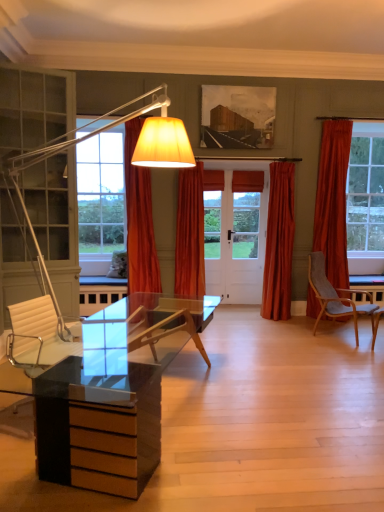
Identify the location of orange velvet curtain at center, the second curtain when ordered from left to right. (190, 234).

Identify the location of fluffy white pillow at left. This screenshot has height=512, width=384. (118, 265).

The image size is (384, 512). Describe the element at coordinates (118, 265) in the screenshot. I see `fluffy white pillow at left` at that location.

Identify the location of velvet orange curtain at center, marked as the 1th curtain in a right-to-left arrangement. (279, 243).

Find the location of a particular element. This screenshot has width=384, height=512. wooden textured painting at upper center is located at coordinates 237,117.

Locate an element on the screen. orange velvet curtain at center, the second curtain when ordered from left to right is located at coordinates (190, 234).

How different are the orientations of orange velvet curtain at center, which is the second curtain from right to left, and fluffy white pillow at left in degrees?

17 degrees.

Which is more to the right, orange velvet curtain at center, which is the second curtain from right to left, or fluffy white pillow at left?

Positioned to the right is orange velvet curtain at center, which is the second curtain from right to left.

Is fluffy white pillow at left at the back of orange velvet curtain at center, the second curtain when ordered from left to right?

No, fluffy white pillow at left is not at the back of orange velvet curtain at center, the second curtain when ordered from left to right.

From the picture: Can you confirm if fluffy white pillow at left is wider than wooden textured painting at upper center?

Indeed, fluffy white pillow at left has a greater width compared to wooden textured painting at upper center.

Is wooden textured painting at upper center a part of fluffy white pillow at left?

No.

Considering the sizes of objects fluffy white pillow at left and wooden textured painting at upper center in the image provided, who is smaller, fluffy white pillow at left or wooden textured painting at upper center?

fluffy white pillow at left.

Between fluffy white pillow at left and wooden textured painting at upper center, which one appears on the right side from the viewer's perspective?

From the viewer's perspective, wooden textured painting at upper center appears more on the right side.

Looking at this image, is orange fabric curtain at center, the third curtain viewed from the right, next to orange velvet curtain at center, the second curtain when ordered from left to right, and touching it?

No, orange fabric curtain at center, the third curtain viewed from the right, is not next to orange velvet curtain at center, the second curtain when ordered from left to right.

Does point (128, 264) come closer to viewer compared to point (200, 172)?

Yes, it is in front of point (200, 172).

Considering the sizes of objects orange fabric curtain at center, the 1th curtain positioned from the left, and orange velvet curtain at center, which is the second curtain from right to left, in the image provided, who is wider, orange fabric curtain at center, the 1th curtain positioned from the left, or orange velvet curtain at center, which is the second curtain from right to left,?

Wider between the two is orange fabric curtain at center, the 1th curtain positioned from the left.

Can you confirm if orange fabric curtain at center, the third curtain viewed from the right, is smaller than orange velvet curtain at center, the second curtain when ordered from left to right?

No.

Between orange velvet curtain at center, the second curtain when ordered from left to right, and orange fabric curtain at center, the 1th curtain positioned from the left, which one appears on the left side from the viewer's perspective?

Positioned to the left is orange fabric curtain at center, the 1th curtain positioned from the left.

Is orange velvet curtain at center, the second curtain when ordered from left to right, far from orange fabric curtain at center, the third curtain viewed from the right?

No, there isn't a large distance between orange velvet curtain at center, the second curtain when ordered from left to right, and orange fabric curtain at center, the third curtain viewed from the right.

Based on their sizes in the image, would you say orange velvet curtain at center, the second curtain when ordered from left to right, is bigger or smaller than orange fabric curtain at center, the 1th curtain positioned from the left?

Clearly, orange velvet curtain at center, the second curtain when ordered from left to right, is smaller in size than orange fabric curtain at center, the 1th curtain positioned from the left.

Are orange velvet curtain at center, which is the second curtain from right to left, and wooden textured painting at upper center located far from each other?

orange velvet curtain at center, which is the second curtain from right to left, is positioned a significant distance from wooden textured painting at upper center.

Is orange velvet curtain at center, which is the second curtain from right to left, spatially inside wooden textured painting at upper center, or outside of it?

orange velvet curtain at center, which is the second curtain from right to left, is located beyond the bounds of wooden textured painting at upper center.

Is orange velvet curtain at center, which is the second curtain from right to left, facing towards wooden textured painting at upper center?

No, orange velvet curtain at center, which is the second curtain from right to left, is not turned towards wooden textured painting at upper center.

Looking at this image, who is taller, orange velvet curtain at center, which is the second curtain from right to left, or wooden textured painting at upper center?

Standing taller between the two is orange velvet curtain at center, which is the second curtain from right to left.

In the scene shown: Considering the sizes of orange velvet curtain at center, the second curtain when ordered from left to right, and velvet orange curtain at center, marked as the 1th curtain in a right-to-left arrangement, in the image, is orange velvet curtain at center, the second curtain when ordered from left to right, wider or thinner than velvet orange curtain at center, marked as the 1th curtain in a right-to-left arrangement,?

Clearly, orange velvet curtain at center, the second curtain when ordered from left to right, has more width compared to velvet orange curtain at center, marked as the 1th curtain in a right-to-left arrangement.

Between orange velvet curtain at center, which is the second curtain from right to left, and velvet orange curtain at center, which ranks as the third curtain in left-to-right order, which one appears on the right side from the viewer's perspective?

velvet orange curtain at center, which ranks as the third curtain in left-to-right order.

Which is in front, orange velvet curtain at center, the second curtain when ordered from left to right, or velvet orange curtain at center, which ranks as the third curtain in left-to-right order?

orange velvet curtain at center, the second curtain when ordered from left to right, is closer to the camera.

Looking at this image, does orange velvet curtain at center, the second curtain when ordered from left to right, touch velvet orange curtain at center, marked as the 1th curtain in a right-to-left arrangement?

No, orange velvet curtain at center, the second curtain when ordered from left to right, is not next to velvet orange curtain at center, marked as the 1th curtain in a right-to-left arrangement.

Can you confirm if velvet orange curtain at center, marked as the 1th curtain in a right-to-left arrangement, is bigger than orange fabric curtain at center, the third curtain viewed from the right?

No, velvet orange curtain at center, marked as the 1th curtain in a right-to-left arrangement, is not bigger than orange fabric curtain at center, the third curtain viewed from the right.

Is velvet orange curtain at center, which ranks as the third curtain in left-to-right order, not inside orange fabric curtain at center, the 1th curtain positioned from the left?

Yes, velvet orange curtain at center, which ranks as the third curtain in left-to-right order, is located beyond the bounds of orange fabric curtain at center, the 1th curtain positioned from the left.

From the image's perspective, is velvet orange curtain at center, marked as the 1th curtain in a right-to-left arrangement, located above or below orange fabric curtain at center, the 1th curtain positioned from the left?

velvet orange curtain at center, marked as the 1th curtain in a right-to-left arrangement, is below orange fabric curtain at center, the 1th curtain positioned from the left.

This screenshot has height=512, width=384. Identify the location of pillow below the orange velvet curtain at center, the second curtain when ordered from left to right (from a real-world perspective). (118, 265).

At what (x,y) coordinates should I click in order to perform the action: click on picture frame located on the right of fluffy white pillow at left. Please return your answer as a coordinate pair (x, y). Looking at the image, I should click on (237, 117).

Looking at the image, which one is located further to wooden textured painting at upper center, orange velvet curtain at center, which is the second curtain from right to left, or velvet orange curtain at center, which ranks as the third curtain in left-to-right order?

orange velvet curtain at center, which is the second curtain from right to left, is further to wooden textured painting at upper center.

Consider the image. Estimate the real-world distances between objects in this image. Which object is further from fluffy white pillow at left, orange velvet curtain at center, the second curtain when ordered from left to right, or orange fabric curtain at center, the third curtain viewed from the right?

The object further to fluffy white pillow at left is orange velvet curtain at center, the second curtain when ordered from left to right.

Based on the photo, based on their spatial positions, is wooden textured painting at upper center or fluffy white pillow at left further from orange velvet curtain at center, which is the second curtain from right to left?

wooden textured painting at upper center.

In the scene shown: Considering their positions, is velvet orange curtain at center, which ranks as the third curtain in left-to-right order, positioned closer to orange fabric curtain at center, the 1th curtain positioned from the left, than fluffy white pillow at left?

fluffy white pillow at left is closer to orange fabric curtain at center, the 1th curtain positioned from the left.

Looking at this image, estimate the real-world distances between objects in this image. Which object is further from orange velvet curtain at center, the second curtain when ordered from left to right, velvet orange curtain at center, which ranks as the third curtain in left-to-right order, or wooden textured painting at upper center?

Based on the image, wooden textured painting at upper center appears to be further to orange velvet curtain at center, the second curtain when ordered from left to right.

Based on their spatial positions, is wooden textured painting at upper center or orange fabric curtain at center, the 1th curtain positioned from the left, closer to fluffy white pillow at left?

Based on the image, orange fabric curtain at center, the 1th curtain positioned from the left, appears to be nearer to fluffy white pillow at left.

Consider the image. From the image, which object appears to be farther from orange velvet curtain at center, which is the second curtain from right to left, wooden textured painting at upper center or velvet orange curtain at center, marked as the 1th curtain in a right-to-left arrangement?

wooden textured painting at upper center.

Based on the photo, from the image, which object appears to be farther from velvet orange curtain at center, which ranks as the third curtain in left-to-right order, wooden textured painting at upper center or orange velvet curtain at center, which is the second curtain from right to left?

Based on the image, orange velvet curtain at center, which is the second curtain from right to left, appears to be further to velvet orange curtain at center, which ranks as the third curtain in left-to-right order.

This screenshot has width=384, height=512. What are the coordinates of `curtain between wooden textured painting at upper center and orange velvet curtain at center, which is the second curtain from right to left, from top to bottom` in the screenshot? It's located at (139, 220).

Find the location of a particular element. This screenshot has width=384, height=512. picture frame situated between orange fabric curtain at center, the 1th curtain positioned from the left, and velvet orange curtain at center, marked as the 1th curtain in a right-to-left arrangement, from left to right is located at coordinates [x=237, y=117].

Identify the location of curtain situated between orange fabric curtain at center, the 1th curtain positioned from the left, and velvet orange curtain at center, marked as the 1th curtain in a right-to-left arrangement, from left to right. (190, 234).

Image resolution: width=384 pixels, height=512 pixels. I want to click on curtain between fluffy white pillow at left and orange velvet curtain at center, which is the second curtain from right to left, so click(139, 220).